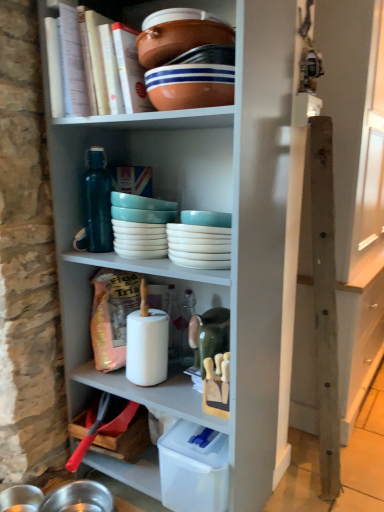
I want to click on brown ceramic bowl at upper center, the 2th bowl when ordered from bottom to top, so click(180, 39).

In order to face brown ceramic bowl at upper center, the 1th bowl when ordered from top to bottom, should I rotate leftwards or rightwards?

Turn left approximately 2.311 degrees to face it.

Find the location of a particular element. This screenshot has width=384, height=512. white glossy bowls at center, the 1th tableware viewed from the right is located at coordinates (201, 240).

What is the approximate width of hardcover book at upper center?

hardcover book at upper center is 32.78 centimeters in width.

You are a GUI agent. You are given a task and a screenshot of the screen. Output one action in this format:
    pyautogui.click(x=<x>, y=<y>)
    Task: Click on the hardcover book at upper center
    
    Given the screenshot: What is the action you would take?
    pyautogui.click(x=109, y=64)

You are a GUI agent. You are given a task and a screenshot of the screen. Output one action in this format:
    pyautogui.click(x=<x>, y=<y>)
    Task: Click on the brown ceramic bowl at upper center, the 2th bowl when ordered from bottom to top
    Image resolution: width=384 pixels, height=512 pixels.
    Given the screenshot: What is the action you would take?
    pyautogui.click(x=180, y=39)

From the image's perspective, is wooden post at right above hardcover book at upper center?

No, from the image's perspective, wooden post at right is not on top of hardcover book at upper center.

Looking at this image, how many degrees apart are the facing directions of wooden post at right and hardcover book at upper center?

87.9 degrees separate the facing orientations of wooden post at right and hardcover book at upper center.

At what (x,y) coordinates should I click in order to perform the action: click on cabinetry behind the hardcover book at upper center. Please return your answer as a coordinate pair (x, y). This screenshot has height=512, width=384. Looking at the image, I should click on (355, 186).

Is wooden post at right further to camera compared to hardcover book at upper center?

Yes, it is behind hardcover book at upper center.

From the image's perspective, is wooden post at right on brown ceramic bowl at upper center, the 1th bowl when ordered from top to bottom?

No, from the image's perspective, wooden post at right is not on top of brown ceramic bowl at upper center, the 1th bowl when ordered from top to bottom.

Consider the image. From a real-world perspective, relative to brown ceramic bowl at upper center, the 2th bowl when ordered from bottom to top, is wooden post at right vertically above or below?

wooden post at right is below brown ceramic bowl at upper center, the 2th bowl when ordered from bottom to top.

Is wooden post at right placed right next to brown ceramic bowl at upper center, the 2th bowl when ordered from bottom to top?

wooden post at right and brown ceramic bowl at upper center, the 2th bowl when ordered from bottom to top, are clearly separated.

Which object is positioned more to the left, wooden post at right or brown ceramic bowl at upper center, the 1th bowl when ordered from top to bottom?

brown ceramic bowl at upper center, the 1th bowl when ordered from top to bottom, is more to the left.

Can you confirm if wooden post at right is wider than white glossy plates at center, placed as the second tableware when sorted from right to left?

Correct, the width of wooden post at right exceeds that of white glossy plates at center, placed as the second tableware when sorted from right to left.

Considering the sizes of objects wooden post at right and white glossy plates at center, placed as the second tableware when sorted from right to left, in the image provided, who is shorter, wooden post at right or white glossy plates at center, placed as the second tableware when sorted from right to left,?

white glossy plates at center, placed as the second tableware when sorted from right to left.

Which object is positioned more to the right, wooden post at right or white glossy plates at center, placed as the second tableware when sorted from right to left?

From the viewer's perspective, wooden post at right appears more on the right side.

How different are the orientations of wooden post at right and white glossy plates at center, placed as the second tableware when sorted from right to left, in degrees?

There is a 87.9-degree angle between the facing directions of wooden post at right and white glossy plates at center, placed as the second tableware when sorted from right to left.

Which object is thinner, wooden post at right or matte ceramic bowl at upper center, positioned as the second bowl in top-to-bottom order?

Thinner between the two is matte ceramic bowl at upper center, positioned as the second bowl in top-to-bottom order.

Considering the sizes of wooden post at right and matte ceramic bowl at upper center, which appears as the first bowl when ordered from the bottom, in the image, is wooden post at right bigger or smaller than matte ceramic bowl at upper center, which appears as the first bowl when ordered from the bottom,?

wooden post at right is bigger than matte ceramic bowl at upper center, which appears as the first bowl when ordered from the bottom.

From the image's perspective, who appears lower, wooden post at right or matte ceramic bowl at upper center, which appears as the first bowl when ordered from the bottom?

From the image's view, wooden post at right is below.

Considering the relative positions of wooden post at right and matte ceramic bowl at upper center, positioned as the second bowl in top-to-bottom order, in the image provided, is wooden post at right to the left or to the right of matte ceramic bowl at upper center, positioned as the second bowl in top-to-bottom order,?

From the image, it's evident that wooden post at right is to the right of matte ceramic bowl at upper center, positioned as the second bowl in top-to-bottom order.

Would you consider matte ceramic bowl at upper center, positioned as the second bowl in top-to-bottom order, to be distant from white glossy bowls at center, the 1th tableware viewed from the right?

No, there isn't a large distance between matte ceramic bowl at upper center, positioned as the second bowl in top-to-bottom order, and white glossy bowls at center, the 1th tableware viewed from the right.

From the image's perspective, does matte ceramic bowl at upper center, positioned as the second bowl in top-to-bottom order, appear higher than white glossy bowls at center, the 2th tableware viewed from the left?

Yes, from the image's perspective, matte ceramic bowl at upper center, positioned as the second bowl in top-to-bottom order, is on top of white glossy bowls at center, the 2th tableware viewed from the left.

Which object is thinner, matte ceramic bowl at upper center, positioned as the second bowl in top-to-bottom order, or white glossy bowls at center, the 1th tableware viewed from the right?

matte ceramic bowl at upper center, positioned as the second bowl in top-to-bottom order.

Which of these two, matte ceramic bowl at upper center, which appears as the first bowl when ordered from the bottom, or white glossy bowls at center, the 1th tableware viewed from the right, stands taller?

white glossy bowls at center, the 1th tableware viewed from the right.

Locate an element on the screen. The image size is (384, 512). the 2nd tableware below the hardcover book at upper center (from the image's perspective) is located at coordinates (201, 240).

In terms of height, does white glossy bowls at center, the 2th tableware viewed from the left, look taller or shorter compared to hardcover book at upper center?

In the image, white glossy bowls at center, the 2th tableware viewed from the left, appears to be shorter than hardcover book at upper center.

Considering the sizes of objects white glossy bowls at center, the 1th tableware viewed from the right, and hardcover book at upper center in the image provided, who is wider, white glossy bowls at center, the 1th tableware viewed from the right, or hardcover book at upper center?

With larger width is hardcover book at upper center.

Are white glossy bowls at center, the 1th tableware viewed from the right, and hardcover book at upper center making contact?

No, white glossy bowls at center, the 1th tableware viewed from the right, is not next to hardcover book at upper center.

Between white glossy bowls at center, the 2th tableware viewed from the left, and brown ceramic bowl at upper center, the 2th bowl when ordered from bottom to top, which one has smaller width?

Thinner between the two is brown ceramic bowl at upper center, the 2th bowl when ordered from bottom to top.

Considering the relative sizes of white glossy bowls at center, the 2th tableware viewed from the left, and brown ceramic bowl at upper center, the 1th bowl when ordered from top to bottom, in the image provided, is white glossy bowls at center, the 2th tableware viewed from the left, smaller than brown ceramic bowl at upper center, the 1th bowl when ordered from top to bottom,?

No.

From a real-world perspective, between white glossy bowls at center, the 2th tableware viewed from the left, and brown ceramic bowl at upper center, the 1th bowl when ordered from top to bottom, who is vertically higher?

brown ceramic bowl at upper center, the 1th bowl when ordered from top to bottom.

Starting from the white glossy bowls at center, the 1th tableware viewed from the right, which bowl is the 2nd one in front? Please provide its 2D coordinates.

[(180, 39)]

Identify the location of cabinetry that is behind the hardcover book at upper center. This screenshot has width=384, height=512. (355, 186).

You are a GUI agent. You are given a task and a screenshot of the screen. Output one action in this format:
    pyautogui.click(x=<x>, y=<y>)
    Task: Click on the cabinetry below the brown ceramic bowl at upper center, the 2th bowl when ordered from bottom to top (from a real-world perspective)
    This screenshot has width=384, height=512.
    Given the screenshot: What is the action you would take?
    pyautogui.click(x=355, y=186)

From the image, which object appears to be nearer to hardcover book at upper center, matte ceramic bowl at upper center, positioned as the second bowl in top-to-bottom order, or white glossy bowls at center, the 1th tableware viewed from the right?

The object closer to hardcover book at upper center is matte ceramic bowl at upper center, positioned as the second bowl in top-to-bottom order.

Based on their spatial positions, is brown ceramic bowl at upper center, the 1th bowl when ordered from top to bottom, or white glossy plates at center, placed as the second tableware when sorted from right to left, further from wooden post at right?

brown ceramic bowl at upper center, the 1th bowl when ordered from top to bottom, is positioned further to the anchor wooden post at right.

Based on their spatial positions, is white glossy plates at center, placed as the second tableware when sorted from right to left, or hardcover book at upper center closer to white glossy bowls at center, the 1th tableware viewed from the right?

Based on the image, white glossy plates at center, placed as the second tableware when sorted from right to left, appears to be nearer to white glossy bowls at center, the 1th tableware viewed from the right.

From the image, which object appears to be farther from hardcover book at upper center, brown ceramic bowl at upper center, the 1th bowl when ordered from top to bottom, or wooden post at right?

wooden post at right lies further to hardcover book at upper center than the other object.

When comparing their distances from wooden post at right, does brown ceramic bowl at upper center, the 2th bowl when ordered from bottom to top, or matte ceramic bowl at upper center, positioned as the second bowl in top-to-bottom order, seem closer?

Among the two, matte ceramic bowl at upper center, positioned as the second bowl in top-to-bottom order, is located nearer to wooden post at right.

Estimate the real-world distances between objects in this image. Which object is closer to brown ceramic bowl at upper center, the 2th bowl when ordered from bottom to top, white glossy plates at center, the first tableware positioned from the left, or white glossy bowls at center, the 1th tableware viewed from the right?

Based on the image, white glossy plates at center, the first tableware positioned from the left, appears to be nearer to brown ceramic bowl at upper center, the 2th bowl when ordered from bottom to top.

When comparing their distances from white glossy plates at center, placed as the second tableware when sorted from right to left, does white glossy bowls at center, the 2th tableware viewed from the left, or hardcover book at upper center seem closer?

white glossy bowls at center, the 2th tableware viewed from the left, is positioned closer to the anchor white glossy plates at center, placed as the second tableware when sorted from right to left.

From the image, which object appears to be farther from white glossy plates at center, the first tableware positioned from the left, wooden post at right or white glossy bowls at center, the 1th tableware viewed from the right?

The object further to white glossy plates at center, the first tableware positioned from the left, is wooden post at right.

Find the location of a particular element. The image size is (384, 512). tableware between brown ceramic bowl at upper center, the 2th bowl when ordered from bottom to top, and white glossy bowls at center, the 2th tableware viewed from the left, from top to bottom is located at coordinates (140, 225).

I want to click on tableware situated between white glossy plates at center, the first tableware positioned from the left, and wooden post at right from left to right, so click(201, 240).

Where is `bowl located between hardcover book at upper center and matte ceramic bowl at upper center, positioned as the second bowl in top-to-bottom order, in the left-right direction`? This screenshot has width=384, height=512. bowl located between hardcover book at upper center and matte ceramic bowl at upper center, positioned as the second bowl in top-to-bottom order, in the left-right direction is located at coordinates (180, 39).

Locate an element on the screen. The width and height of the screenshot is (384, 512). bowl between brown ceramic bowl at upper center, the 2th bowl when ordered from bottom to top, and white glossy bowls at center, the 2th tableware viewed from the left, vertically is located at coordinates (190, 86).